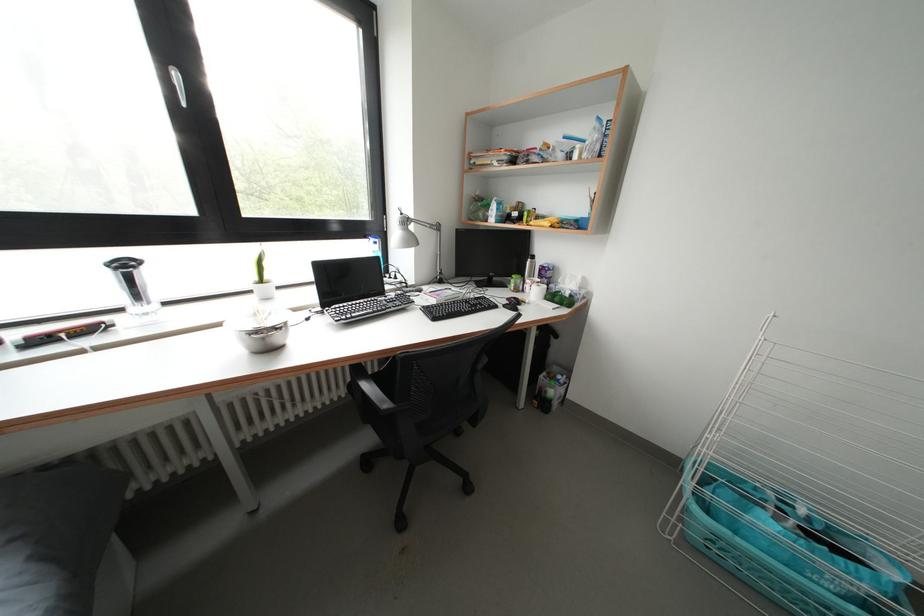
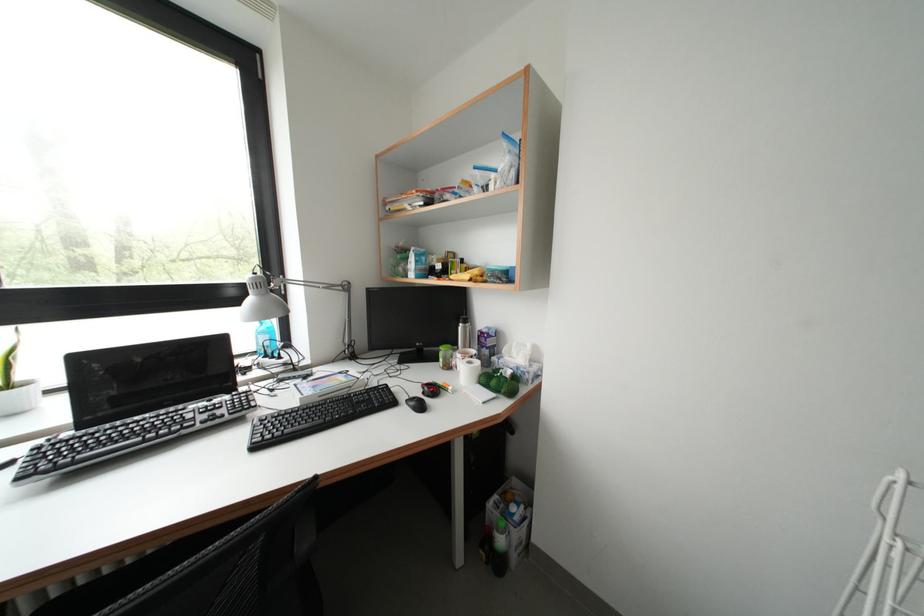
Locate, in the second image, the point that corresponds to point 564,304 in the first image.

(500, 387)